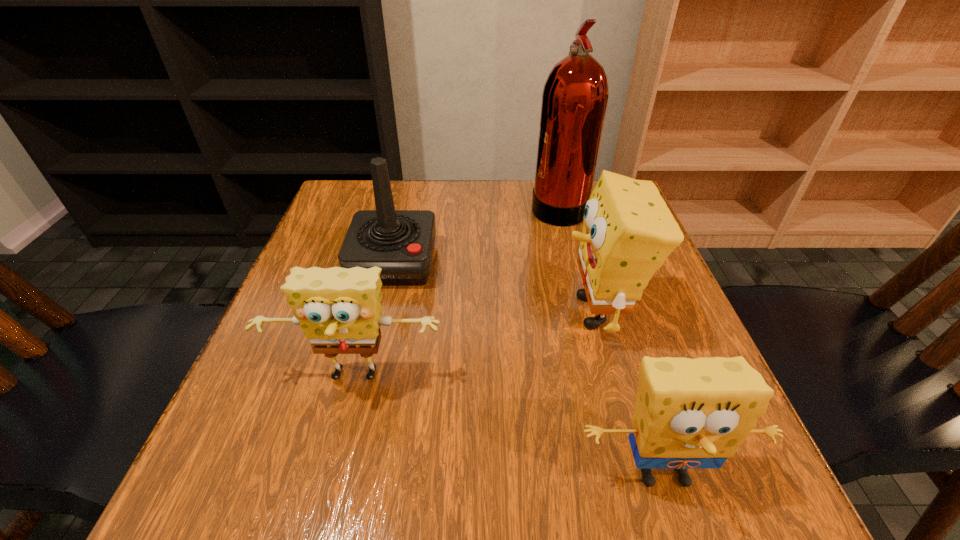
This screenshot has height=540, width=960. In order to click on free location located on the face of the tallest sponge in this screenshot , I will do click(x=452, y=312).

This screenshot has height=540, width=960. What are the coordinates of `vacant region located 0.300m on the face of the tallest sponge` in the screenshot? It's located at (406, 312).

At what (x,y) coordinates should I click in order to perform the action: click on vacant space located 0.190m on the face of the tallest sponge. Please return your answer as a coordinate pair (x, y). The width and height of the screenshot is (960, 540). Looking at the image, I should click on (463, 312).

I want to click on free space located 0.290m on the front-facing side of the joystick, so click(358, 414).

Locate an element on the screen. This screenshot has height=540, width=960. vacant space situated on the face of the second nearest object is located at coordinates (321, 514).

Locate an element on the screen. The image size is (960, 540). object that is positioned at the far edge is located at coordinates [x=575, y=95].

At what (x,y) coordinates should I click in order to perform the action: click on object that is at the near edge. Please return your answer as a coordinate pair (x, y). The width and height of the screenshot is (960, 540). Looking at the image, I should click on (689, 413).

Image resolution: width=960 pixels, height=540 pixels. Identify the location of joystick present at the left edge. (401, 242).

Locate an element on the screen. sponge at the left edge is located at coordinates (339, 309).

Find the location of a particular element. The height and width of the screenshot is (540, 960). fire extinguisher that is at the right edge is located at coordinates (575, 95).